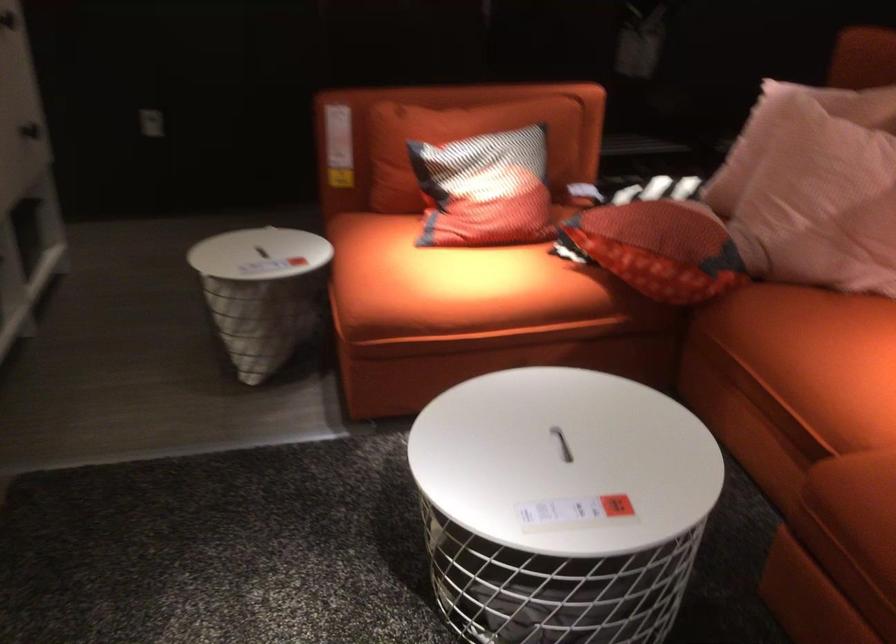
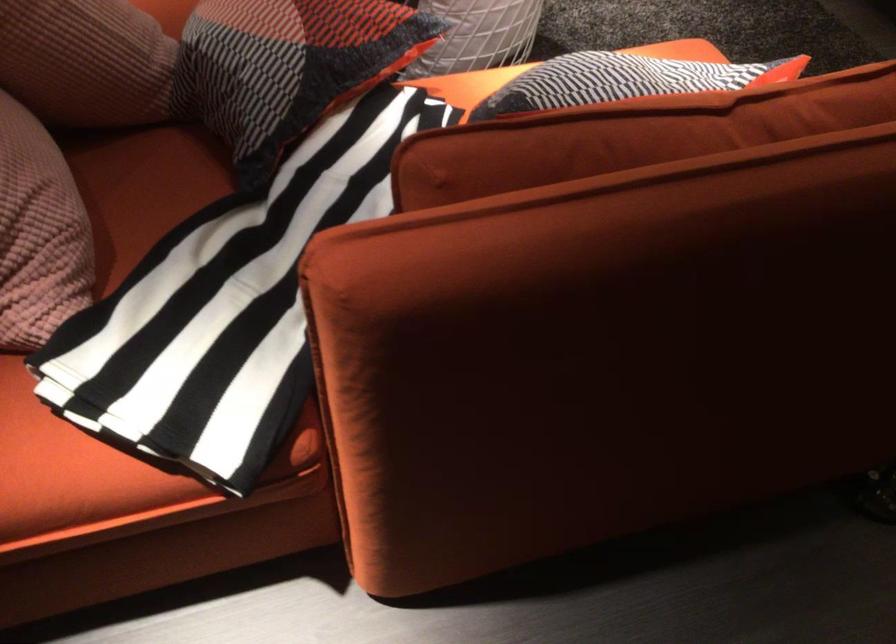
Where in the second image is the point corresponding to (x=746, y=184) from the first image?

(85, 61)